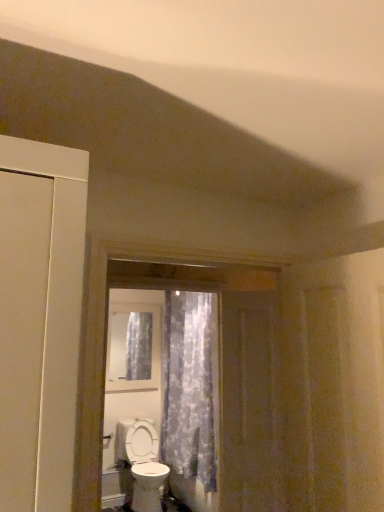
Question: Is brown wooden screen door at center oriented away from clear glass window at center?

Choices:
 (A) no
 (B) yes

Answer: (A)

Question: Is brown wooden screen door at center shorter than clear glass window at center?

Choices:
 (A) yes
 (B) no

Answer: (B)

Question: Would you say brown wooden screen door at center is outside clear glass window at center?

Choices:
 (A) no
 (B) yes

Answer: (B)

Question: From a real-world perspective, is brown wooden screen door at center below clear glass window at center?

Choices:
 (A) yes
 (B) no

Answer: (A)

Question: Is brown wooden screen door at center at the left side of clear glass window at center?

Choices:
 (A) yes
 (B) no

Answer: (B)

Question: In terms of height, does brown wooden screen door at center look taller or shorter compared to clear glass window at center?

Choices:
 (A) tall
 (B) short

Answer: (A)

Question: Would you say brown wooden screen door at center is to the left or to the right of clear glass window at center in the picture?

Choices:
 (A) left
 (B) right

Answer: (B)

Question: From a real-world perspective, relative to clear glass window at center, is brown wooden screen door at center vertically above or below?

Choices:
 (A) below
 (B) above

Answer: (A)

Question: Considering the positions of point (231, 393) and point (122, 364), is point (231, 393) closer or farther from the camera than point (122, 364)?

Choices:
 (A) closer
 (B) farther

Answer: (A)

Question: From their relative heights in the image, would you say translucent floral fabric at center is taller or shorter than clear glass window at center?

Choices:
 (A) short
 (B) tall

Answer: (B)

Question: Considering the positions of translucent floral fabric at center and clear glass window at center in the image, is translucent floral fabric at center wider or thinner than clear glass window at center?

Choices:
 (A) wide
 (B) thin

Answer: (A)

Question: From a real-world perspective, is translucent floral fabric at center physically located above or below clear glass window at center?

Choices:
 (A) above
 (B) below

Answer: (B)

Question: Considering the relative positions of translucent floral fabric at center and clear glass window at center in the image provided, is translucent floral fabric at center to the left or to the right of clear glass window at center?

Choices:
 (A) left
 (B) right

Answer: (B)

Question: In terms of size, does white glossy toilet at lower center appear bigger or smaller than brown wooden screen door at center?

Choices:
 (A) big
 (B) small

Answer: (A)

Question: In terms of width, does white glossy toilet at lower center look wider or thinner when compared to brown wooden screen door at center?

Choices:
 (A) thin
 (B) wide

Answer: (B)